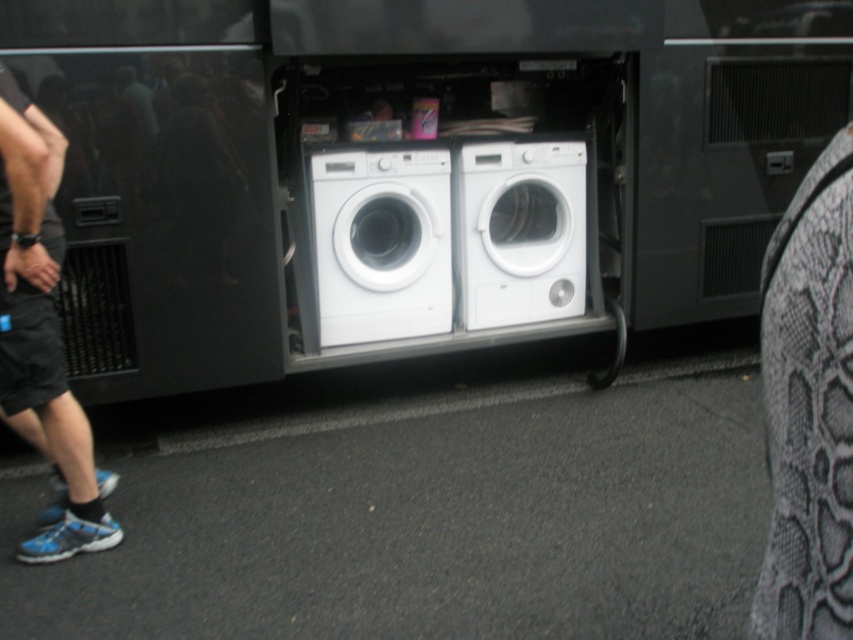
You are standing outside the bus and looking at the open panel. You see the blue fabric shorts at lower left and the white glossy washing machine at center. Which object is closer to the left side of the open panel?

The blue fabric shorts at lower left is closer to the left side of the open panel because it is positioned to the left of the white glossy washing machine at center.

You are standing outside the bus and looking at the open side panel. You notice a person partially visible inside. Where exactly is the blue fabric shorts at lower left located in relation to the open panel?

The blue fabric shorts at lower left are located at the coordinates point (42, 333) relative to the open panel.

You are standing outside the bus and want to place a new white glossy washing machine at center. Where should you place it?

You should place the new white glossy washing machine at center at point [381,244].